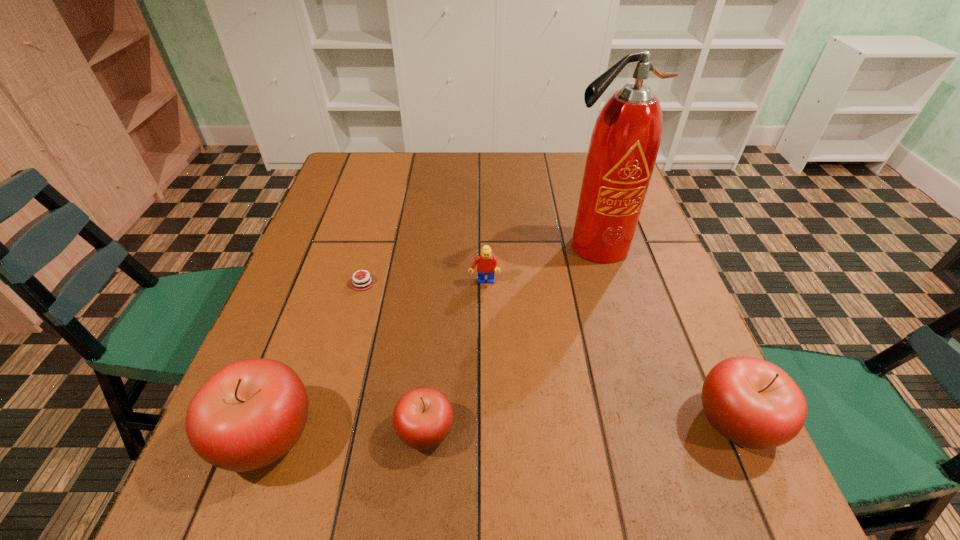
This screenshot has width=960, height=540. In the image, there is a desktop. Find the location of `free space at the far edge`. free space at the far edge is located at coordinates (453, 176).

In the image, there is a desktop. At what (x,y) coordinates should I click in order to perform the action: click on vacant space at the near edge. Please return your answer as a coordinate pair (x, y). Looking at the image, I should click on (588, 444).

Locate an element on the screen. The height and width of the screenshot is (540, 960). vacant space at the left edge is located at coordinates (330, 323).

In order to click on vacant space at the right edge in this screenshot , I will do [x=652, y=303].

Identify the location of vacant space at the far left corner. This screenshot has width=960, height=540. (341, 172).

Find the location of a particular element. This screenshot has height=540, width=960. vacant region between the Lego and the third object from left to right is located at coordinates (455, 356).

Where is `free space between the third object from right to left and the shortest object`? The height and width of the screenshot is (540, 960). free space between the third object from right to left and the shortest object is located at coordinates (423, 283).

Locate an element on the screen. This screenshot has height=540, width=960. vacant area that lies between the shortest object and the rightmost apple is located at coordinates (549, 352).

Identify the location of free spot between the fourth object from left to right and the fourth object from right to left. The image size is (960, 540). (455, 356).

Locate an element on the screen. Image resolution: width=960 pixels, height=540 pixels. vacant area that lies between the Lego and the fire extinguisher is located at coordinates (540, 264).